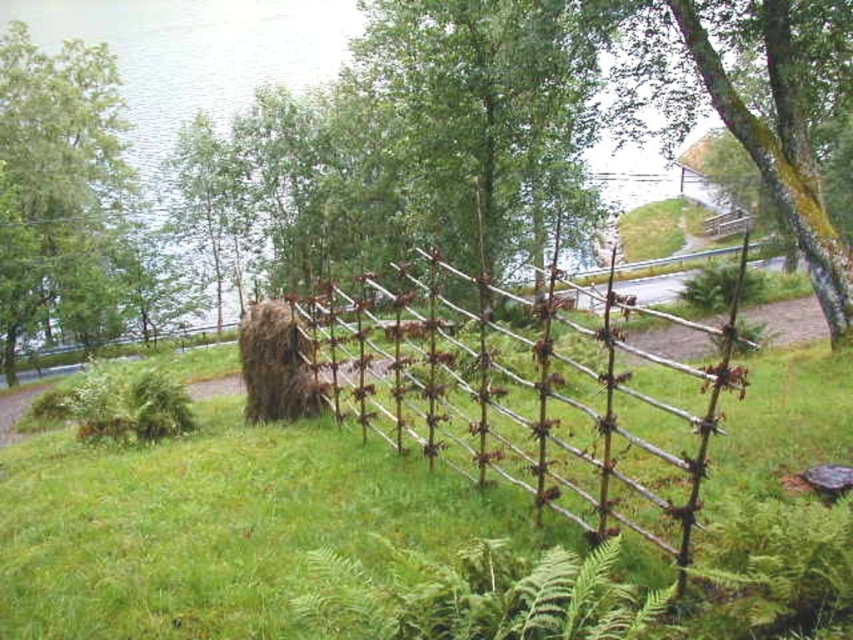
Between point (357, 324) and point (73, 296), which one is positioned behind?

The point (73, 296) is more distant.

Image resolution: width=853 pixels, height=640 pixels. Describe the element at coordinates (514, 394) in the screenshot. I see `brown wooden fence at center` at that location.

Identify the location of brown wooden fence at center. (514, 394).

Who is positioned more to the left, green leafy tree at upper left or brown grassy hay at center?

green leafy tree at upper left is more to the left.

Is green leafy tree at upper left positioned before brown grassy hay at center?

That is False.

Is point (44, 316) in front of point (296, 326)?

No, it is not.

You are a GUI agent. You are given a task and a screenshot of the screen. Output one action in this format:
    pyautogui.click(x=<x>, y=<y>)
    Task: Click on the green leafy tree at upper left
    The height and width of the screenshot is (640, 853).
    Given the screenshot: What is the action you would take?
    [57, 193]

Which is below, green grassy at center or brown wooden fence at center?

Positioned lower is green grassy at center.

Is point (305, 468) in front of point (456, 321)?

Yes, point (305, 468) is in front of point (456, 321).

Identify the location of green grassy at center. (216, 525).